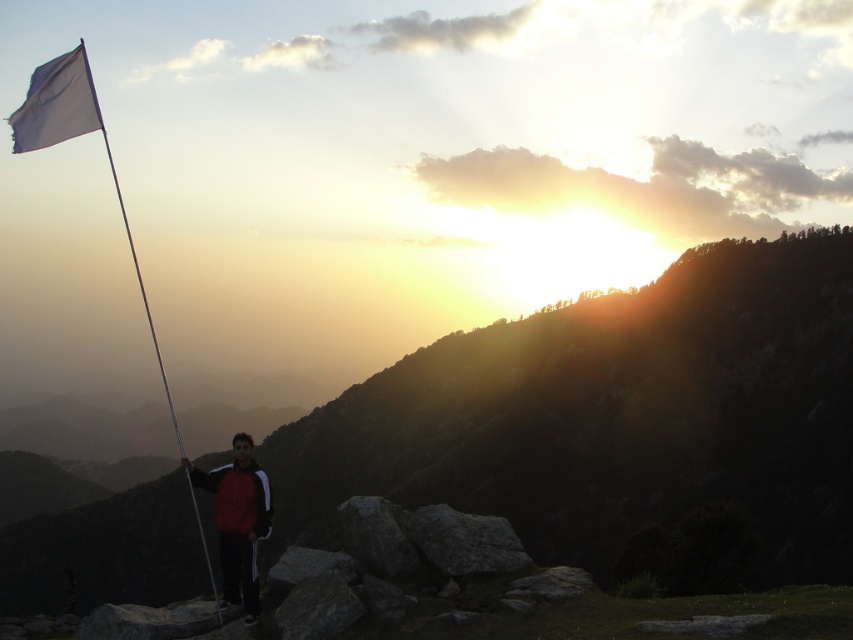
Question: Does red jacket at center have a greater width compared to white fabric flag at left?

Choices:
 (A) no
 (B) yes

Answer: (A)

Question: Which of the following is the farthest from the observer?

Choices:
 (A) (199, 522)
 (B) (56, 593)
 (C) (224, 483)

Answer: (A)

Question: Which point is closer to the camera taking this photo?

Choices:
 (A) (672, 481)
 (B) (128, 241)

Answer: (A)

Question: Is matte black flag at upper left above red jacket at center?

Choices:
 (A) yes
 (B) no

Answer: (A)

Question: Can you confirm if red jacket at center is smaller than white fabric flag at left?

Choices:
 (A) no
 (B) yes

Answer: (B)

Question: Which point is closer to the camera taking this photo?

Choices:
 (A) (776, 246)
 (B) (132, 241)

Answer: (A)